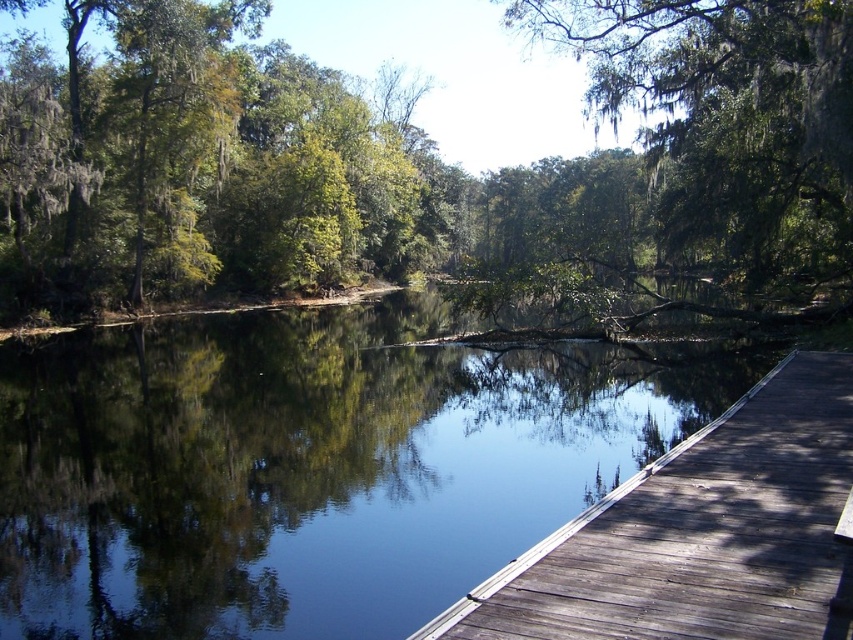
Measure the distance between green leafy tree at center and dark brown wooden dock at lower right.

Answer: green leafy tree at center and dark brown wooden dock at lower right are 88.59 meters apart from each other.

Does green leafy tree at center have a larger size compared to dark brown wooden dock at lower right?

Yes.

Does point (242, 148) come in front of point (666, 460)?

No, it is behind (666, 460).

Find the location of a particular element. This screenshot has width=853, height=640. green leafy tree at center is located at coordinates (421, 160).

You are a GUI agent. You are given a task and a screenshot of the screen. Output one action in this format:
    pyautogui.click(x=<x>, y=<y>)
    Task: Click on the dark brown wooden dock at lower right
    
    Given the screenshot: What is the action you would take?
    pyautogui.click(x=700, y=532)

Between dark brown wooden dock at lower right and green mossy tree at upper center, which one appears on the right side from the viewer's perspective?

From the viewer's perspective, green mossy tree at upper center appears more on the right side.

Identify the location of dark brown wooden dock at lower right. This screenshot has width=853, height=640. tap(700, 532).

Does green leafy tree at center come in front of green mossy tree at upper center?

No, it is behind green mossy tree at upper center.

Between point (56, 205) and point (730, 145), which one is positioned in front?

Positioned in front is point (730, 145).

I want to click on green leafy tree at center, so click(421, 160).

This screenshot has height=640, width=853. Identify the location of green leafy tree at center. (421, 160).